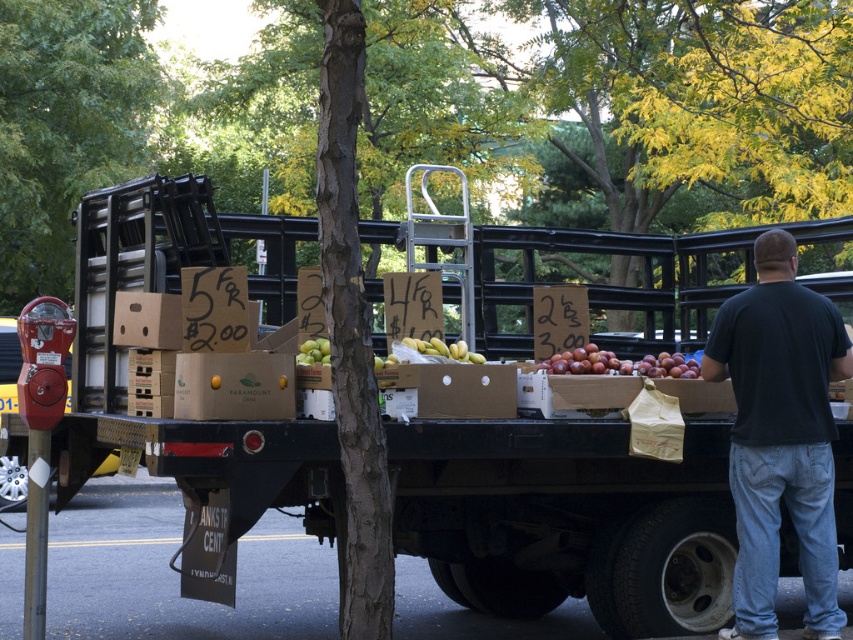
You are a customer at the outdoor market and want to place your shopping bag between the brown cardboard boxes at center and the black cotton shirt at right. Can you fit it there?

The brown cardboard boxes at center are wider than the black cotton shirt at right, so there might not be enough space to fit your shopping bag between them.

You are a customer standing at the front of the flatbed truck and looking towards the back. Which item is closer to you, the brown cardboard boxes at center or the black cotton shirt at right?

The brown cardboard boxes at center are closer to you because they are located below the black cotton shirt at right, meaning they are positioned in front of it from your perspective.

Looking at this image, you are a customer at the outdoor market and want to buy an item from the brown cardboard boxes at center and the black cotton shirt at right. Which item is located to the left of the other?

The brown cardboard boxes at center is positioned on the left side of black cotton shirt at right, so the brown cardboard boxes at center is to the left of the black cotton shirt at right.